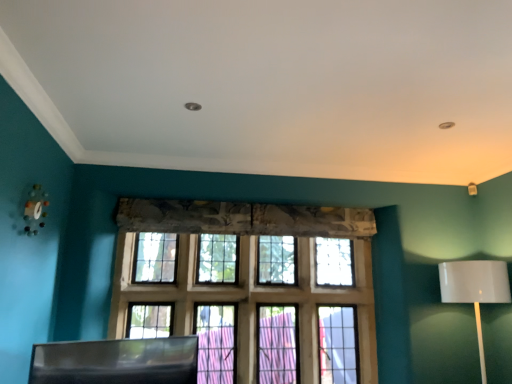
You are a GUI agent. You are given a task and a screenshot of the screen. Output one action in this format:
    pyautogui.click(x=<x>, y=<y>)
    Task: Click on the wooden grid window at center
    
    Given the screenshot: What is the action you would take?
    pyautogui.click(x=251, y=287)

From a real-world perspective, is black plastic swivel chair at lower left positioned under wooden grid window at center based on gravity?

Yes, from a real-world perspective, black plastic swivel chair at lower left is beneath wooden grid window at center.

Based on the photo, can you confirm if black plastic swivel chair at lower left is thinner than wooden grid window at center?

Yes.

Is black plastic swivel chair at lower left beside wooden grid window at center?

No, black plastic swivel chair at lower left is not making contact with wooden grid window at center.

Is the depth of black plastic swivel chair at lower left greater than that of wooden grid window at center?

No, it is in front of wooden grid window at center.

Is wooden grid window at center positioned far away from black plastic swivel chair at lower left?

Indeed, wooden grid window at center is not near black plastic swivel chair at lower left.

From the image's perspective, is wooden grid window at center under black plastic swivel chair at lower left?

No, from the image's perspective, wooden grid window at center is not beneath black plastic swivel chair at lower left.

Is wooden grid window at center positioned behind black plastic swivel chair at lower left?

Yes, it is behind black plastic swivel chair at lower left.

From a real-world perspective, is black plastic swivel chair at lower left on top of white glossy table lamp at right?

No, from a real-world perspective, black plastic swivel chair at lower left is not over white glossy table lamp at right

Does black plastic swivel chair at lower left turn towards white glossy table lamp at right?

No.

You are a GUI agent. You are given a task and a screenshot of the screen. Output one action in this format:
    pyautogui.click(x=<x>, y=<y>)
    Task: Click on the swivel chair below the white glossy table lamp at right (from the image's perspective)
    This screenshot has height=384, width=512.
    Given the screenshot: What is the action you would take?
    pyautogui.click(x=116, y=361)

Is white glossy table lamp at right surrounded by black plastic swivel chair at lower left?

That's incorrect, white glossy table lamp at right is not inside black plastic swivel chair at lower left.

Is white glossy table lamp at right not close to black plastic swivel chair at lower left?

Absolutely, white glossy table lamp at right is distant from black plastic swivel chair at lower left.

From the image's perspective, is white glossy table lamp at right positioned above or below black plastic swivel chair at lower left?

Clearly, from the image's perspective, white glossy table lamp at right is above black plastic swivel chair at lower left.

Where is `swivel chair below the white glossy table lamp at right (from the image's perspective)`? The width and height of the screenshot is (512, 384). swivel chair below the white glossy table lamp at right (from the image's perspective) is located at coordinates (116, 361).

Does white glossy table lamp at right have a greater width compared to black plastic swivel chair at lower left?

Yes, white glossy table lamp at right is wider than black plastic swivel chair at lower left.

Are white glossy table lamp at right and wooden grid window at center far apart?

Yes, white glossy table lamp at right and wooden grid window at center are located far from each other.

Can you confirm if white glossy table lamp at right is positioned to the right of wooden grid window at center?

Indeed, white glossy table lamp at right is positioned on the right side of wooden grid window at center.

Is wooden grid window at center closer to the viewer compared to white glossy table lamp at right?

No, wooden grid window at center is further to the viewer.

From the picture: Looking at their sizes, would you say wooden grid window at center is wider or thinner than white glossy table lamp at right?

wooden grid window at center is thinner than white glossy table lamp at right.

Can you confirm if wooden grid window at center is taller than white glossy table lamp at right?

Yes.

What's the angular difference between wooden grid window at center and white glossy table lamp at right's facing directions?

2.93 degrees.

Where is `window that is above the black plastic swivel chair at lower left (from the image's perspective)`? The image size is (512, 384). window that is above the black plastic swivel chair at lower left (from the image's perspective) is located at coordinates (x=251, y=287).

The height and width of the screenshot is (384, 512). Find the location of `swivel chair below the wooden grid window at center (from the image's perspective)`. swivel chair below the wooden grid window at center (from the image's perspective) is located at coordinates (116, 361).

When comparing their distances from white glossy table lamp at right, does black plastic swivel chair at lower left or wooden grid window at center seem closer?

Based on the image, wooden grid window at center appears to be nearer to white glossy table lamp at right.

Based on their spatial positions, is wooden grid window at center or black plastic swivel chair at lower left further from white glossy table lamp at right?

The object further to white glossy table lamp at right is black plastic swivel chair at lower left.

Looking at the image, which one is located further to wooden grid window at center, black plastic swivel chair at lower left or white glossy table lamp at right?

Among the two, white glossy table lamp at right is located further to wooden grid window at center.

Looking at the image, which one is located closer to wooden grid window at center, white glossy table lamp at right or black plastic swivel chair at lower left?

Among the two, black plastic swivel chair at lower left is located nearer to wooden grid window at center.

Considering their positions, is white glossy table lamp at right positioned closer to black plastic swivel chair at lower left than wooden grid window at center?

wooden grid window at center.

Looking at the image, which one is located closer to black plastic swivel chair at lower left, wooden grid window at center or white glossy table lamp at right?

Among the two, wooden grid window at center is located nearer to black plastic swivel chair at lower left.

At what (x,y) coordinates should I click in order to perform the action: click on window between black plastic swivel chair at lower left and white glossy table lamp at right. Please return your answer as a coordinate pair (x, y). The width and height of the screenshot is (512, 384). Looking at the image, I should click on (251, 287).